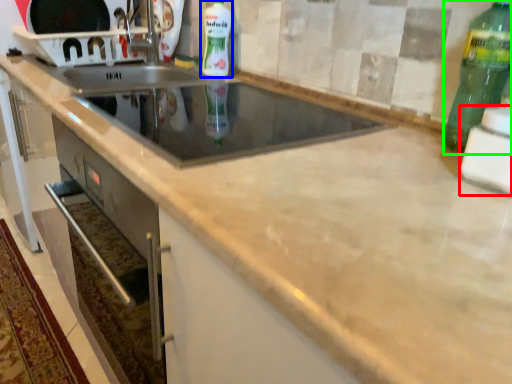
Question: Which object is positioned farthest from appliance (highlighted by a red box)? Select from bottle (highlighted by a blue box) and bottle (highlighted by a green box).

Choices:
 (A) bottle
 (B) bottle

Answer: (A)